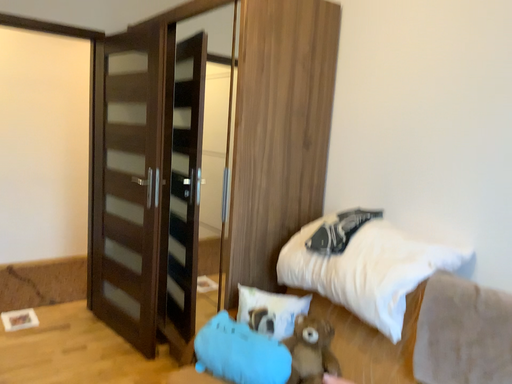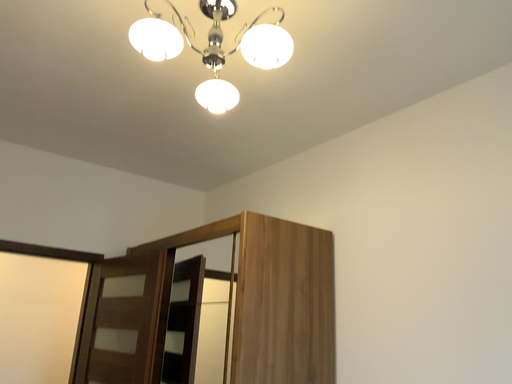
Question: Which way did the camera rotate in the video?

Choices:
 (A) rotated upward
 (B) rotated downward

Answer: (A)